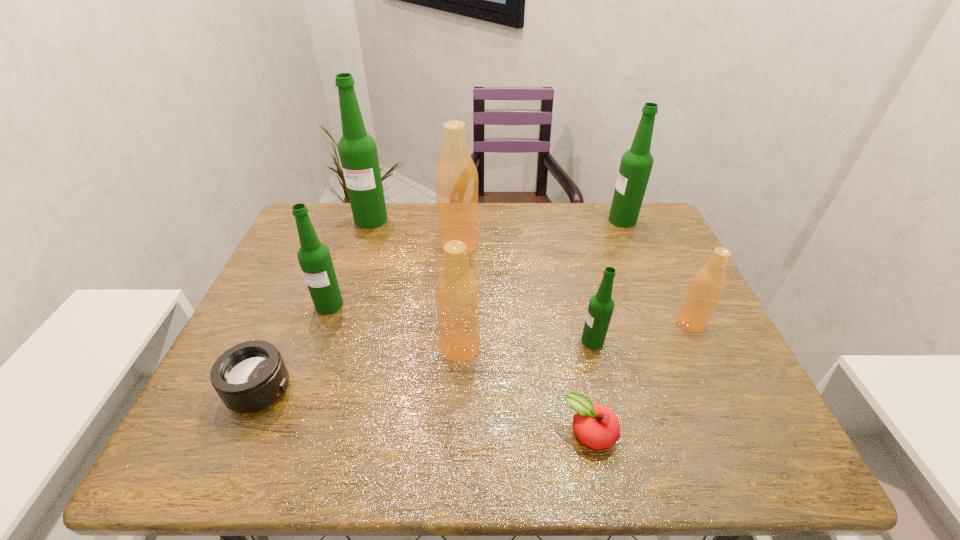
Find the location of `free space between the apple and the rightmost tan beer bottle`. free space between the apple and the rightmost tan beer bottle is located at coordinates (640, 378).

Where is `object that can be found as the fourth closest to the third farthest beer bottle`? This screenshot has width=960, height=540. object that can be found as the fourth closest to the third farthest beer bottle is located at coordinates (600, 309).

Locate which object is the closest to the second biggest tan beer bottle. Please provide its 2D coordinates. Your answer should be formatted as a tuple, i.e. [(x, y)], where the tuple contains the x and y coordinates of a point satisfying the conditions above.

[(596, 426)]

I want to click on beer bottle that is the fifth nearest to the third beer bottle from right to left, so click(x=314, y=257).

Where is `the fourth closest beer bottle to the telephoto lens`? This screenshot has height=540, width=960. the fourth closest beer bottle to the telephoto lens is located at coordinates (357, 150).

Choose which green beer bottle is the fourth nearest neighbor to the smallest tan beer bottle. Please provide its 2D coordinates. Your answer should be formatted as a tuple, i.e. [(x, y)], where the tuple contains the x and y coordinates of a point satisfying the conditions above.

[(357, 150)]

Point out which green beer bottle is positioned as the third nearest to the biggest tan beer bottle. Please provide its 2D coordinates. Your answer should be formatted as a tuple, i.e. [(x, y)], where the tuple contains the x and y coordinates of a point satisfying the conditions above.

[(600, 309)]

Locate which tan beer bottle ranks in proximity to the second smallest tan beer bottle. Please provide its 2D coordinates. Your answer should be formatted as a tuple, i.e. [(x, y)], where the tuple contains the x and y coordinates of a point satisfying the conditions above.

[(456, 178)]

Locate an element on the screen. This screenshot has width=960, height=540. tan beer bottle object that ranks as the third closest to the nearest green beer bottle is located at coordinates (456, 178).

Identify the location of free location that satisfies the following two spatial constraints: 1. on the label of the third biggest green beer bottle; 2. on the left side of the red apple. (283, 434).